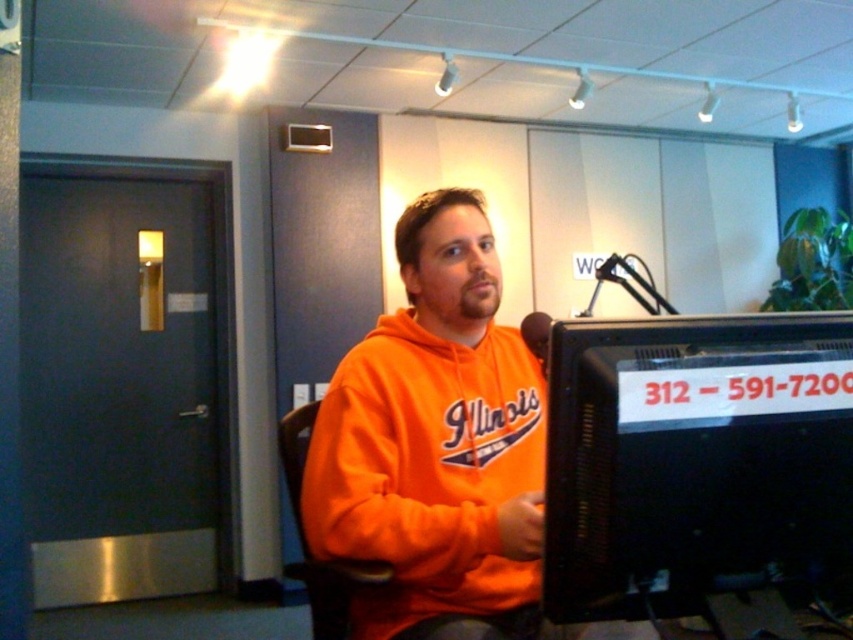
You are a technician adjusting the camera position in a radio station. You need to focus on two points in the scene. The first point is at coordinate point (589, 396) and the second is at point (306, 593). Which point should you focus on first if you want to start with the one closer to the camera?

Point (589, 396) is closer to the camera than point (306, 593), so you should focus on point (589, 396) first.

You are an interior designer assessing the layout of this room. You notice the orange fleece sweatshirt at center and the orange fabric swivel chair at center. Which object is positioned closer to the entrance of the room?

The orange fleece sweatshirt at center is closer to the entrance of the room because it is closer to the viewer than the orange fabric swivel chair at center, which is positioned further back.

You are designing a layout for a small studio and need to place the black plastic monitor at right and orange fabric swivel chair at center. Given their sizes, which object should be placed closer to the wall to save space?

The black plastic monitor at right occupies less space than the orange fabric swivel chair at center, so placing the orange fabric swivel chair at center closer to the wall would allow the monitor to be positioned further out without overcrowding the space.